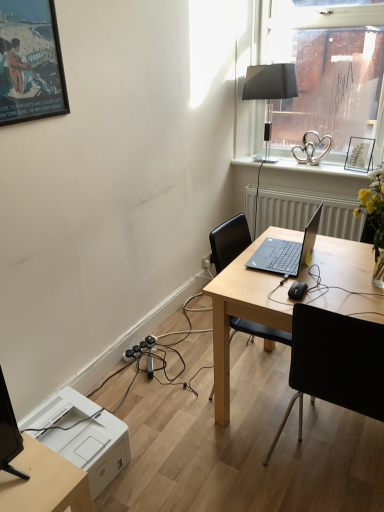
Locate an element on the screen. free space in front of black plastic mouse at lower right is located at coordinates (322, 306).